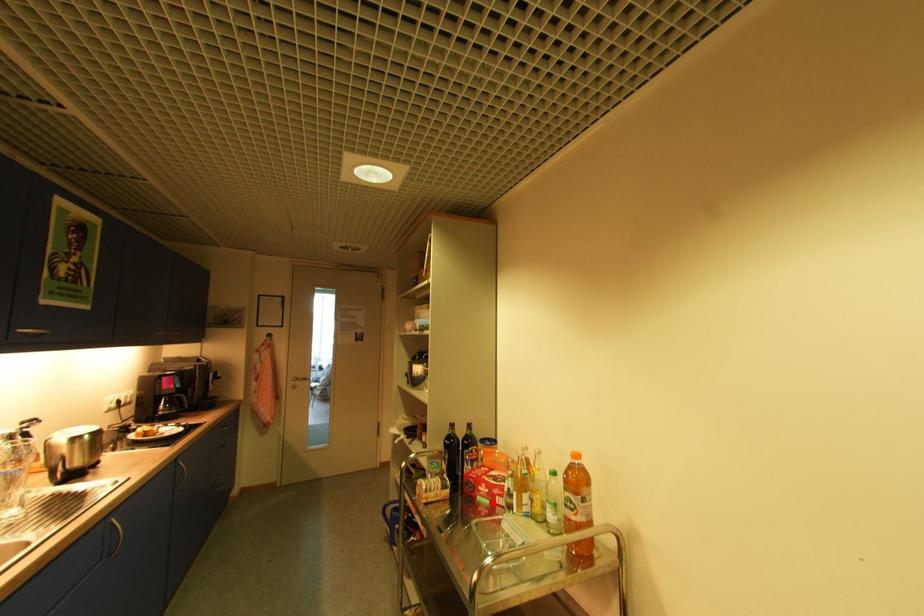
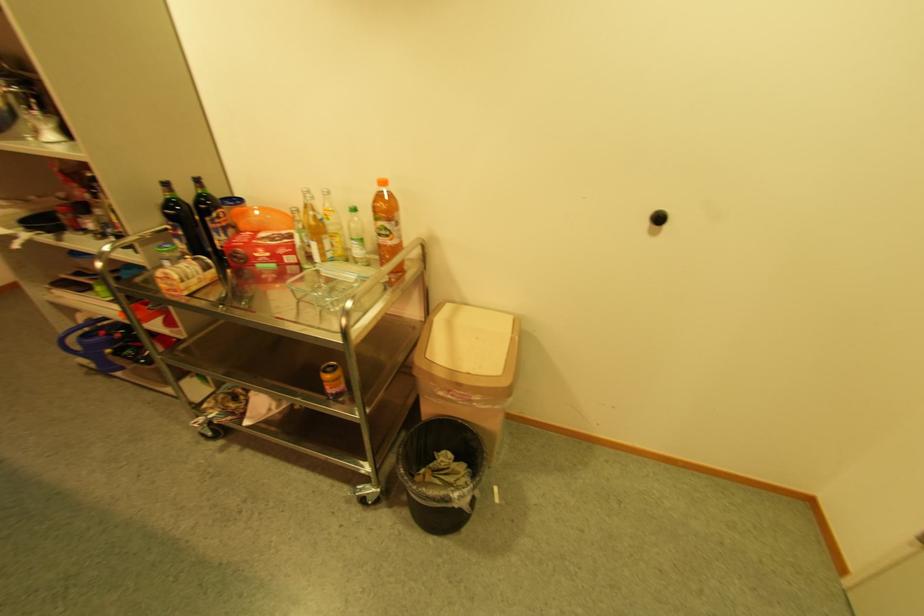
Question: I am providing you with two images of the same scene from different viewpoints. Given a red point in image1, look at the same physical point in image2. Is it:

Choices:
 (A) Closer to the viewpoint
 (B) Farther from the viewpoint

Answer: (A)